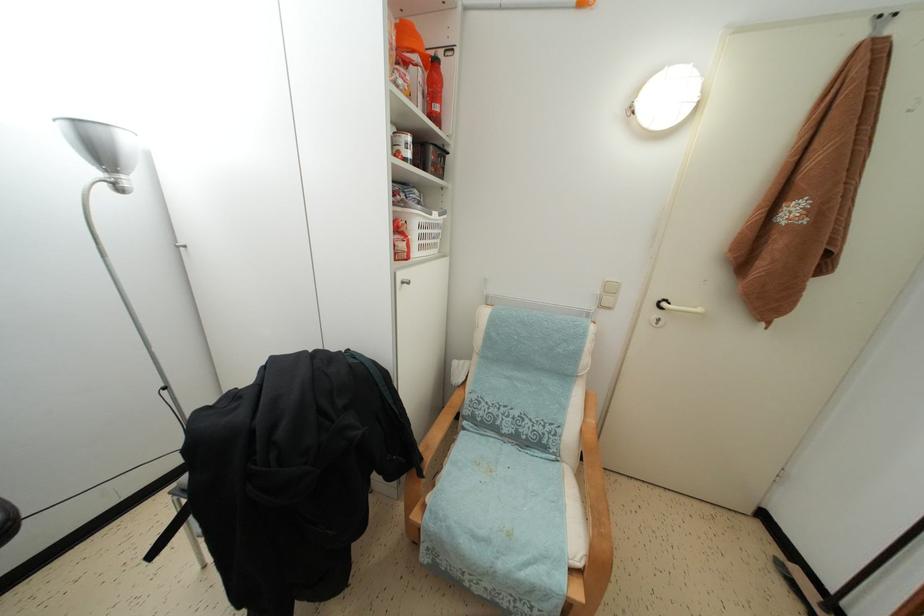
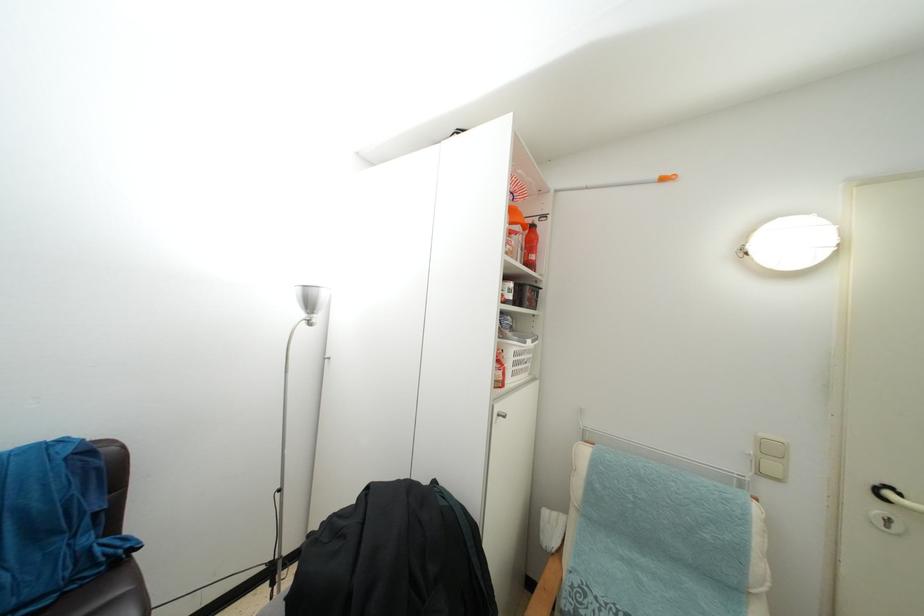
The point at (440,68) is marked in the first image. Where is the corresponding point in the second image?

(537, 233)